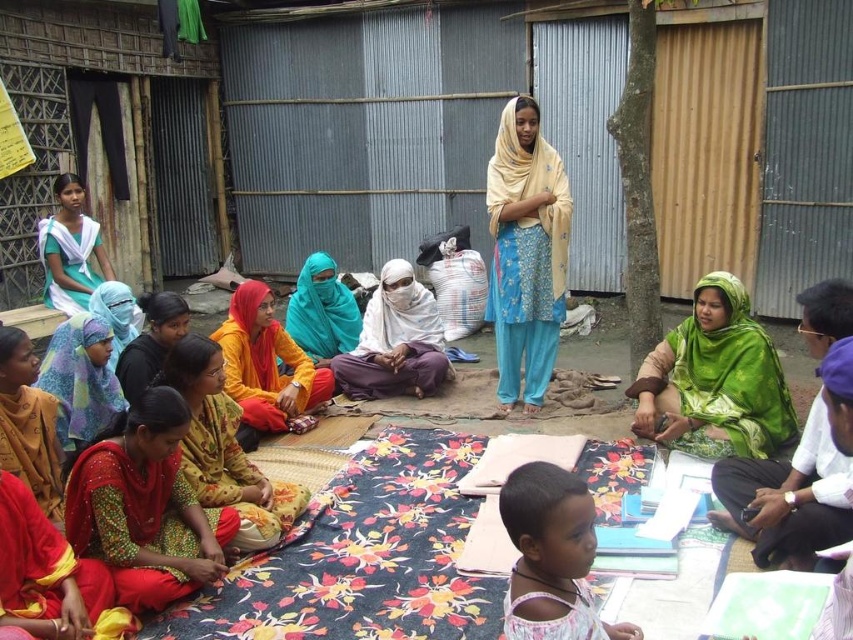
Question: Among these points, which one is nearest to the camera?

Choices:
 (A) (509, 369)
 (B) (573, 579)
 (C) (693, 292)

Answer: (B)

Question: From the image, what is the correct spatial relationship of red fabric saree at lower left in relation to printed fabric dress at center?

Choices:
 (A) above
 (B) below

Answer: (B)

Question: Which object is the farthest from the printed fabric dress at center?

Choices:
 (A) teal fabric headscarf at center
 (B) light blue fabric at upper left

Answer: (B)

Question: In this image, where is matte yellow scarf at lower left located relative to light blue fabric at upper left?

Choices:
 (A) above
 (B) below

Answer: (B)

Question: Which object is closer to the camera taking this photo?

Choices:
 (A) printed fabric dress at center
 (B) green satin scarf at lower right

Answer: (A)

Question: Where is green satin scarf at lower right located in relation to light pink fabric at lower center in the image?

Choices:
 (A) above
 (B) below

Answer: (A)